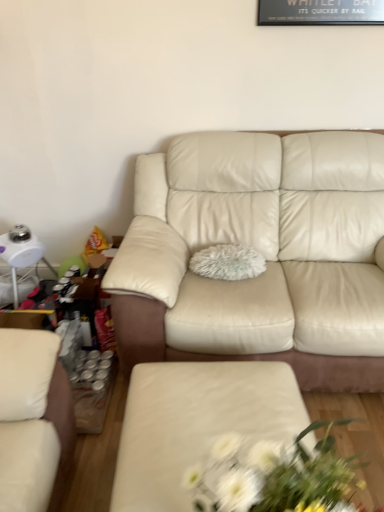
Question: Based on their positions, is cream leather couch at center located to the left or right of matte cream ottoman at center?

Choices:
 (A) right
 (B) left

Answer: (A)

Question: From the image's perspective, is cream leather couch at center positioned above or below matte cream ottoman at center?

Choices:
 (A) above
 (B) below

Answer: (A)

Question: Estimate the real-world distances between objects in this image. Which object is farther from the white fabric floral arrangement at center?

Choices:
 (A) matte cream ottoman at center
 (B) cream leather couch at center
 (C) fluffy white pillow at center

Answer: (C)

Question: Which of these objects is positioned closest to the matte cream ottoman at center?

Choices:
 (A) fluffy white pillow at center
 (B) white fabric floral arrangement at center
 (C) cream leather couch at center

Answer: (B)